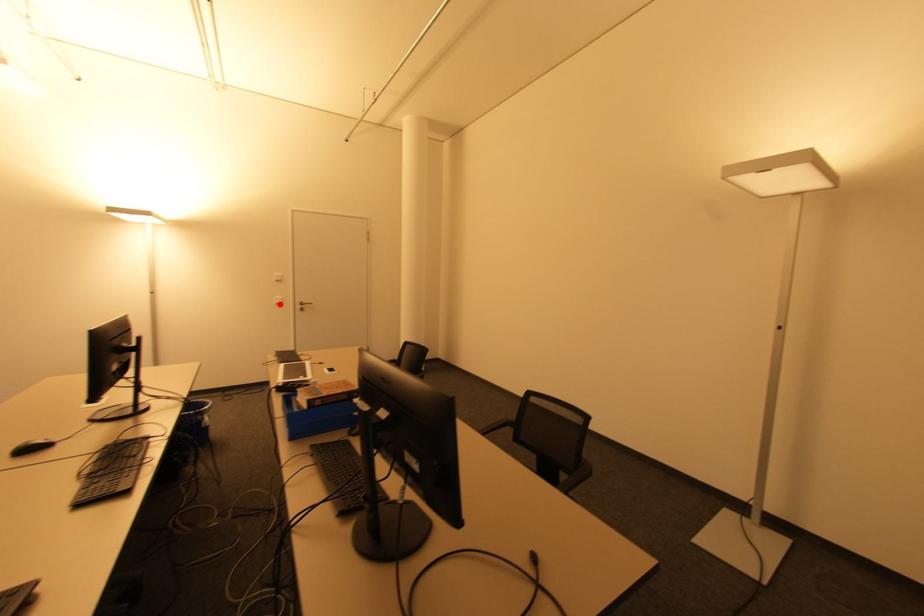
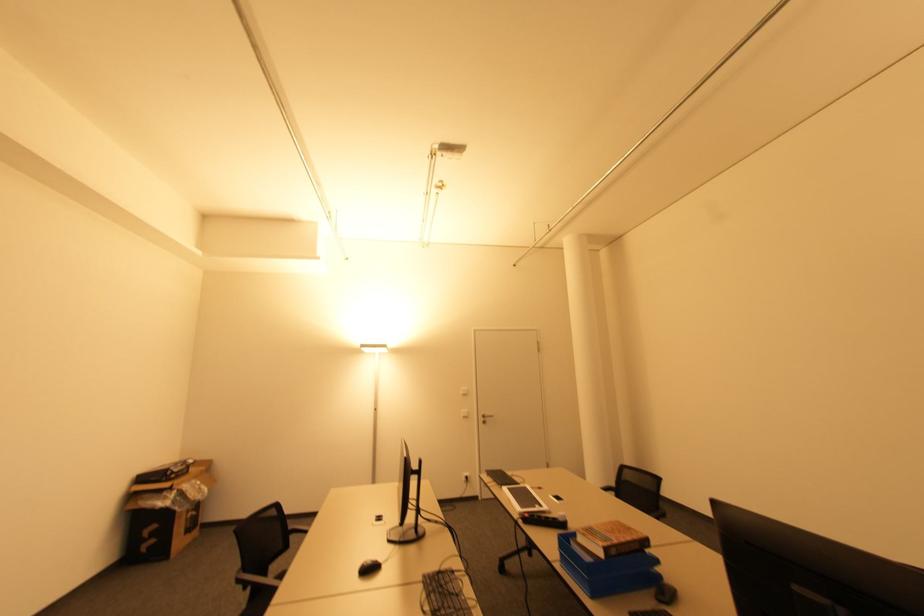
Question: A red point is marked in image1. In image2, is the corresponding 3D point closer to the camera or farther? Reply with the corresponding letter.

Choices:
 (A) The corresponding 3D point is closer.
 (B) The corresponding 3D point is farther.

Answer: (B)